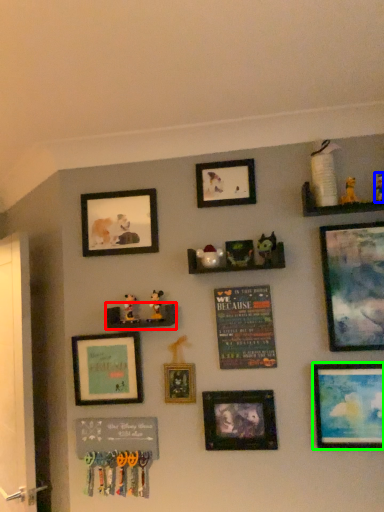
Question: Which object is positioned closest to shelf (highlighted by a red box)? Select from toy (highlighted by a blue box) and picture frame (highlighted by a green box).

Choices:
 (A) toy
 (B) picture frame

Answer: (B)